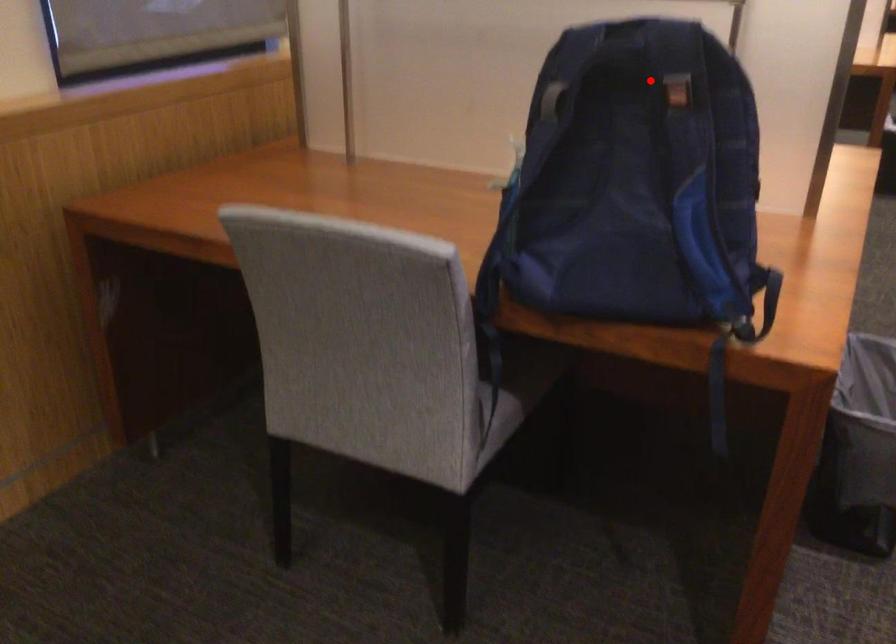
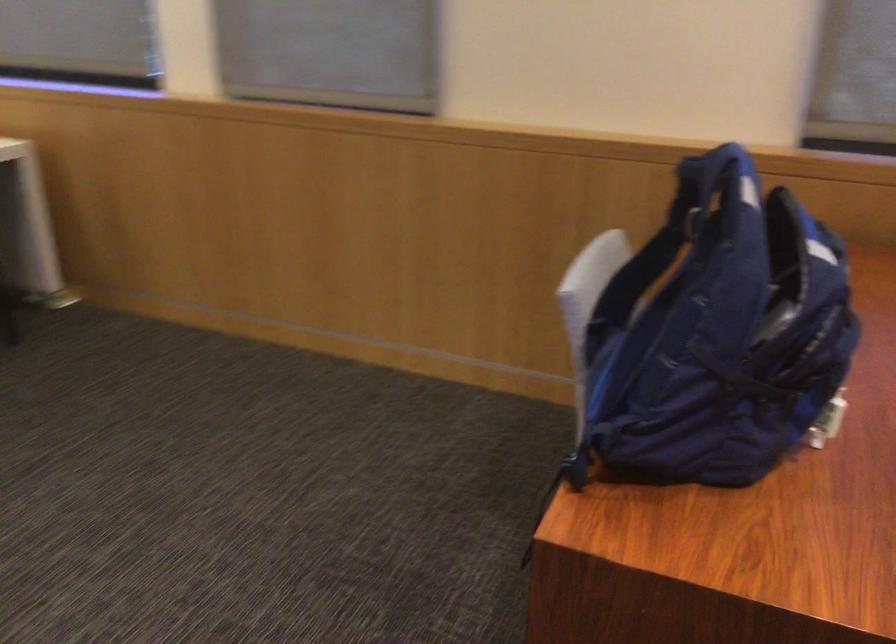
Question: A red point is marked in image1. In image2, is the corresponding 3D point closer to the camera or farther? Reply with the corresponding letter.

Choices:
 (A) The corresponding 3D point is closer.
 (B) The corresponding 3D point is farther.

Answer: (A)